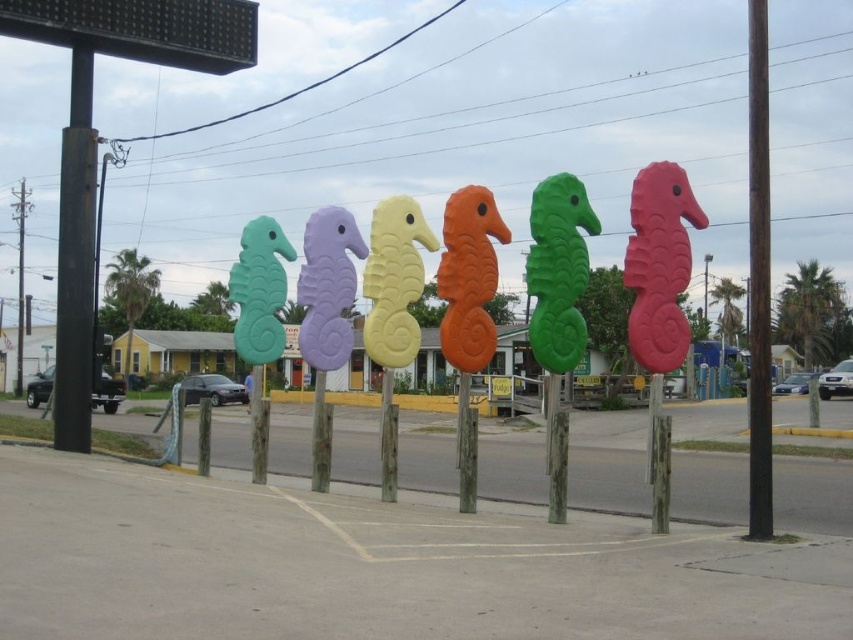
You are a delivery person trying to find a parking spot near the brown wooden pole at right and the white plastic sign at center. Since the parking area is narrow, you need to know which object is higher to avoid hitting it with your vehicle. Can you tell me which one is taller?

The brown wooden pole at right is located above the white plastic sign at center, so the brown wooden pole at right is taller than the white plastic sign at center.

You are a delivery person trying to secure a package on your bike rack. The bike rack has a maximum width capacity of 30 cm. You have two items to secure. The first item is the brown wooden pole at right, and the second is the white plastic sign at center. Based on the scene, can both items fit on the rack if placed side by side?

The brown wooden pole at right is wider than the white plastic sign at center. Since the bike rack can only hold up to 30 cm, and the combined width of both items would exceed this limit, they cannot both fit side by side.